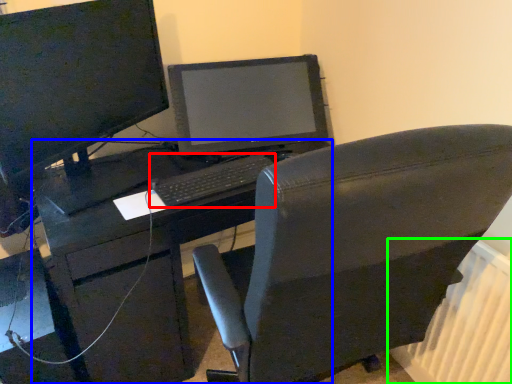
Question: Based on their relative distances, which object is farther from computer keyboard (highlighted by a red box)? Choose from desk (highlighted by a blue box) and radiator (highlighted by a green box).

Choices:
 (A) desk
 (B) radiator

Answer: (B)